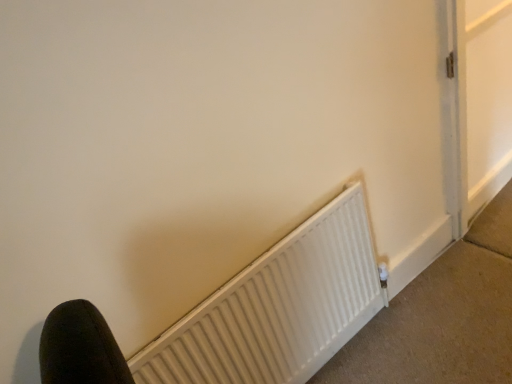
Question: Considering the positions of white matte radiator at lower center and white matte radiator at lower center in the image, is white matte radiator at lower center wider or thinner than white matte radiator at lower center?

Choices:
 (A) wide
 (B) thin

Answer: (B)

Question: Would you say white matte radiator at lower center is inside or outside white matte radiator at lower center?

Choices:
 (A) outside
 (B) inside

Answer: (A)

Question: From the image's perspective, is white matte radiator at lower center positioned above or below white matte radiator at lower center?

Choices:
 (A) below
 (B) above

Answer: (B)

Question: From a real-world perspective, is white matte radiator at lower center above or below white matte radiator at lower center?

Choices:
 (A) below
 (B) above

Answer: (A)

Question: Is white matte radiator at lower center inside the boundaries of white matte radiator at lower center, or outside?

Choices:
 (A) outside
 (B) inside

Answer: (A)

Question: Considering the positions of white matte radiator at lower center and white matte radiator at lower center in the image, is white matte radiator at lower center taller or shorter than white matte radiator at lower center?

Choices:
 (A) tall
 (B) short

Answer: (B)

Question: Is white matte radiator at lower center in front of or behind white matte radiator at lower center in the image?

Choices:
 (A) front
 (B) behind

Answer: (B)